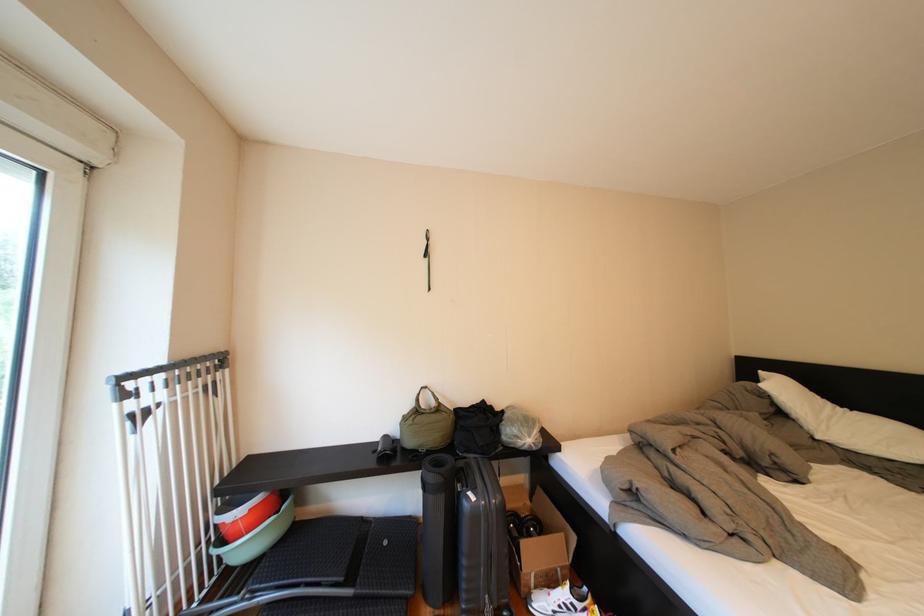
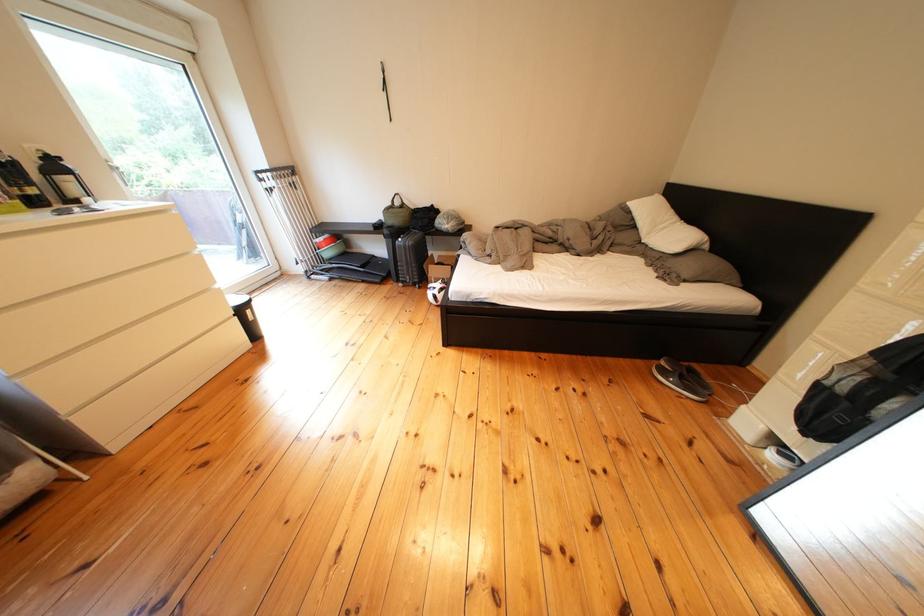
Where in the second image is the point corresponding to point 795,419 from the first image?

(649, 230)